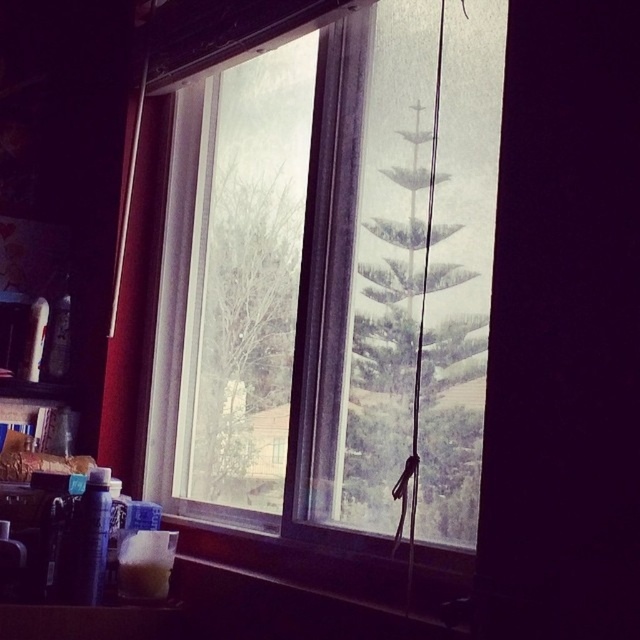
You are an architect designing a new building and want to ensure that the window in the design allows a view of the green matte tree at center. Given that the window is divided into two sections, left and right, which side of the window should the tree be placed on to be visible through the right side?

The green matte tree at center is located on the right side of the window, so to be visible through the right side of the window, the tree should be placed on the right side.

You are an interior designer assessing the room layout. The transparent glass window at center and the green matte tree at center are both in your view. Which object occupies more horizontal space in the scene?

The transparent glass window at center has a larger width than the green matte tree at center, so it occupies more horizontal space in the scene.

You are an interior designer assessing the view from this window. You notice the green matte tree at center and the bare branches at center. Which of these two objects takes up more visual space in the scene?

The green matte tree at center occupies less space than bare branches at center, so the bare branches at center takes up more visual space in the scene.